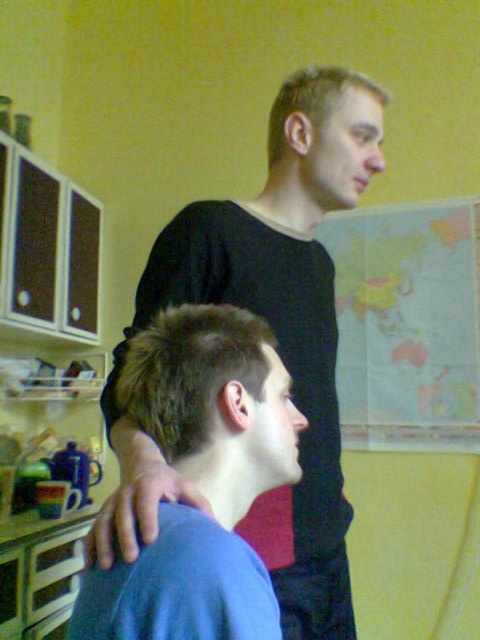
Can you confirm if black matte shirt at upper center is bigger than blue matte shirt at center?

Yes, black matte shirt at upper center is bigger than blue matte shirt at center.

Is point (300, 161) positioned behind point (277, 452)?

Yes, it is.

Locate an element on the screen. black matte shirt at upper center is located at coordinates (276, 339).